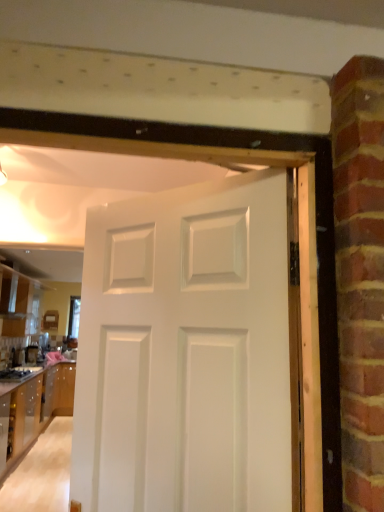
This screenshot has width=384, height=512. Describe the element at coordinates (33, 412) in the screenshot. I see `wooden cabinet at lower left, which appears as the second cabinetry when viewed from the top` at that location.

Measure the distance between point (29, 284) and camera.

Point (29, 284) is 6.29 meters away from camera.

Locate an element on the screen. The height and width of the screenshot is (512, 384). white matte door at center is located at coordinates (186, 351).

At what (x,y) coordinates should I click in order to perform the action: click on cabinetry above the white matte door at center (from a real-world perspective). Please return your answer as a coordinate pair (x, y). The width and height of the screenshot is (384, 512). Looking at the image, I should click on (20, 303).

From the image's perspective, between white matte door at center and glossy wood cabinetry at left, the 1th cabinetry in the top-to-bottom sequence, who is located below?

glossy wood cabinetry at left, the 1th cabinetry in the top-to-bottom sequence.

Is white matte door at center positioned with its back to glossy wood cabinetry at left, the 2th cabinetry ordered from the bottom?

No.

Is point (99, 485) more distant than point (39, 288)?

No, it is in front of (39, 288).

Considering the sizes of objects white matte door at center and satin black coffee maker at lower left in the image provided, who is shorter, white matte door at center or satin black coffee maker at lower left?

satin black coffee maker at lower left is shorter.

Find the location of a particular element. door that is on the right side of satin black coffee maker at lower left is located at coordinates (186, 351).

Is white matte door at center oriented towards satin black coffee maker at lower left?

No, white matte door at center does not turn towards satin black coffee maker at lower left.

Based on the photo, is white matte door at center next to satin black coffee maker at lower left?

No, white matte door at center is not in contact with satin black coffee maker at lower left.

Does point (38, 348) lie behind point (37, 293)?

No.

Where is `appliance on the left of glossy wood cabinetry at left, the 1th cabinetry in the top-to-bottom sequence`? This screenshot has height=512, width=384. appliance on the left of glossy wood cabinetry at left, the 1th cabinetry in the top-to-bottom sequence is located at coordinates (31, 354).

Relative to glossy wood cabinetry at left, the 1th cabinetry in the top-to-bottom sequence, is satin black coffee maker at lower left in front or behind?

satin black coffee maker at lower left is positioned farther from the viewer than glossy wood cabinetry at left, the 1th cabinetry in the top-to-bottom sequence.

Is satin black coffee maker at lower left taller than glossy wood cabinetry at left, the 2th cabinetry ordered from the bottom?

Incorrect, the height of satin black coffee maker at lower left is not larger of that of glossy wood cabinetry at left, the 2th cabinetry ordered from the bottom.

From the image's perspective, which object appears higher, glossy wood cabinetry at left, the 2th cabinetry ordered from the bottom, or white matte door at center?

white matte door at center appears higher in the image.

Is glossy wood cabinetry at left, the 2th cabinetry ordered from the bottom, not inside white matte door at center?

Absolutely, glossy wood cabinetry at left, the 2th cabinetry ordered from the bottom, is external to white matte door at center.

Considering the sizes of objects glossy wood cabinetry at left, the 2th cabinetry ordered from the bottom, and white matte door at center in the image provided, who is wider, glossy wood cabinetry at left, the 2th cabinetry ordered from the bottom, or white matte door at center?

Wider between the two is glossy wood cabinetry at left, the 2th cabinetry ordered from the bottom.

Can you see glossy wood cabinetry at left, the 1th cabinetry in the top-to-bottom sequence, touching white matte door at center?

No, glossy wood cabinetry at left, the 1th cabinetry in the top-to-bottom sequence, is not touching white matte door at center.

Which is less distant, (15, 424) or (14, 286)?

Point (15, 424) appears to be closer to the viewer than point (14, 286).

Is wooden cabinet at lower left, acting as the 1th cabinetry starting from the bottom, spatially inside glossy wood cabinetry at left, the 2th cabinetry ordered from the bottom, or outside of it?

wooden cabinet at lower left, acting as the 1th cabinetry starting from the bottom, lies outside glossy wood cabinetry at left, the 2th cabinetry ordered from the bottom.

Which object is more forward, wooden cabinet at lower left, acting as the 1th cabinetry starting from the bottom, or glossy wood cabinetry at left, the 2th cabinetry ordered from the bottom?

wooden cabinet at lower left, acting as the 1th cabinetry starting from the bottom, is in front.

Is wooden cabinet at lower left, which appears as the second cabinetry when viewed from the top, placed right next to glossy wood cabinetry at left, the 2th cabinetry ordered from the bottom?

wooden cabinet at lower left, which appears as the second cabinetry when viewed from the top, and glossy wood cabinetry at left, the 2th cabinetry ordered from the bottom, are not in contact.

From the image's perspective, between glossy wood cabinetry at left, the 1th cabinetry in the top-to-bottom sequence, and wooden cabinet at lower left, which appears as the second cabinetry when viewed from the top, which one is located above?

glossy wood cabinetry at left, the 1th cabinetry in the top-to-bottom sequence, from the image's perspective.

Based on the photo, considering the sizes of objects glossy wood cabinetry at left, the 1th cabinetry in the top-to-bottom sequence, and wooden cabinet at lower left, acting as the 1th cabinetry starting from the bottom, in the image provided, who is thinner, glossy wood cabinetry at left, the 1th cabinetry in the top-to-bottom sequence, or wooden cabinet at lower left, acting as the 1th cabinetry starting from the bottom,?

glossy wood cabinetry at left, the 1th cabinetry in the top-to-bottom sequence.

Is point (39, 312) closer to camera compared to point (8, 429)?

No, it is behind (8, 429).

Identify the location of cabinetry above the wooden cabinet at lower left, acting as the 1th cabinetry starting from the bottom (from the image's perspective). This screenshot has height=512, width=384. (20, 303).

Is wooden cabinet at lower left, which appears as the second cabinetry when viewed from the top, not near satin black coffee maker at lower left?

That's not correct — wooden cabinet at lower left, which appears as the second cabinetry when viewed from the top, is a little close to satin black coffee maker at lower left.

Consider the image. How much distance is there between wooden cabinet at lower left, acting as the 1th cabinetry starting from the bottom, and satin black coffee maker at lower left?

They are 36.96 inches apart.

The width and height of the screenshot is (384, 512). I want to click on appliance on the left of wooden cabinet at lower left, acting as the 1th cabinetry starting from the bottom, so click(x=31, y=354).

Considering the sizes of wooden cabinet at lower left, which appears as the second cabinetry when viewed from the top, and satin black coffee maker at lower left in the image, is wooden cabinet at lower left, which appears as the second cabinetry when viewed from the top, wider or thinner than satin black coffee maker at lower left?

In the image, wooden cabinet at lower left, which appears as the second cabinetry when viewed from the top, appears to be wider than satin black coffee maker at lower left.

This screenshot has height=512, width=384. I want to click on cabinetry above the white matte door at center (from a real-world perspective), so click(x=20, y=303).

This screenshot has width=384, height=512. In the image, there is a white matte door at center. What are the coordinates of `appliance below it (from a real-world perspective)` in the screenshot? It's located at (31, 354).

When comparing their distances from satin black coffee maker at lower left, does glossy wood cabinetry at left, the 1th cabinetry in the top-to-bottom sequence, or white matte door at center seem closer?

Among the two, glossy wood cabinetry at left, the 1th cabinetry in the top-to-bottom sequence, is located nearer to satin black coffee maker at lower left.

When comparing their distances from white matte door at center, does wooden cabinet at lower left, which appears as the second cabinetry when viewed from the top, or satin black coffee maker at lower left seem further?

Based on the image, satin black coffee maker at lower left appears to be further to white matte door at center.

Based on their spatial positions, is glossy wood cabinetry at left, the 2th cabinetry ordered from the bottom, or wooden cabinet at lower left, which appears as the second cabinetry when viewed from the top, closer to satin black coffee maker at lower left?

The object closer to satin black coffee maker at lower left is glossy wood cabinetry at left, the 2th cabinetry ordered from the bottom.

Based on the photo, when comparing their distances from white matte door at center, does wooden cabinet at lower left, acting as the 1th cabinetry starting from the bottom, or glossy wood cabinetry at left, the 1th cabinetry in the top-to-bottom sequence, seem closer?

Among the two, wooden cabinet at lower left, acting as the 1th cabinetry starting from the bottom, is located nearer to white matte door at center.

Estimate the real-world distances between objects in this image. Which object is further from glossy wood cabinetry at left, the 2th cabinetry ordered from the bottom, wooden cabinet at lower left, acting as the 1th cabinetry starting from the bottom, or satin black coffee maker at lower left?

wooden cabinet at lower left, acting as the 1th cabinetry starting from the bottom, lies further to glossy wood cabinetry at left, the 2th cabinetry ordered from the bottom, than the other object.

Based on their spatial positions, is wooden cabinet at lower left, acting as the 1th cabinetry starting from the bottom, or white matte door at center closer to glossy wood cabinetry at left, the 2th cabinetry ordered from the bottom?

Among the two, wooden cabinet at lower left, acting as the 1th cabinetry starting from the bottom, is located nearer to glossy wood cabinetry at left, the 2th cabinetry ordered from the bottom.

Estimate the real-world distances between objects in this image. Which object is closer to wooden cabinet at lower left, acting as the 1th cabinetry starting from the bottom, satin black coffee maker at lower left or white matte door at center?

satin black coffee maker at lower left.

Estimate the real-world distances between objects in this image. Which object is further from glossy wood cabinetry at left, the 2th cabinetry ordered from the bottom, white matte door at center or satin black coffee maker at lower left?

Based on the image, white matte door at center appears to be further to glossy wood cabinetry at left, the 2th cabinetry ordered from the bottom.

Image resolution: width=384 pixels, height=512 pixels. Identify the location of cabinetry between white matte door at center and glossy wood cabinetry at left, the 2th cabinetry ordered from the bottom, from front to back. (33, 412).

Find the location of a particular element. Image resolution: width=384 pixels, height=512 pixels. cabinetry positioned between wooden cabinet at lower left, acting as the 1th cabinetry starting from the bottom, and satin black coffee maker at lower left from near to far is located at coordinates (20, 303).